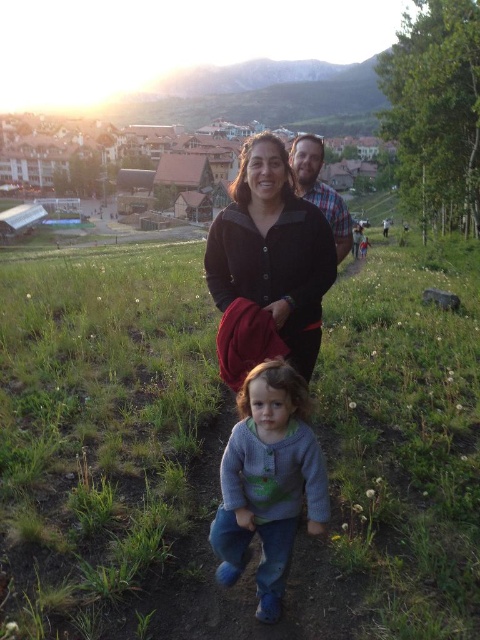
You are a photographer trying to capture a shot of the green grassy at center and the knitted sweater at center. Which object should you focus on first if you want to ensure both are in focus?

The knitted sweater at center should be focused on first since it is closer to the camera than the green grassy at center, which is further away.

You are a photographer trying to capture a photo of the green grassy at center and the plaid shirt at center. Which object would appear larger in the photo?

The green grassy at center would appear larger in the photo because it is bigger than the plaid shirt at center.

You are standing at the origin point of the image. Which direction should you move to reach the green grassy at center?

Since the green grassy at center is located at coordinates point 0.681 on the x axis and 0.215 on the y axis, you should move to the right and slightly upwards to reach it.